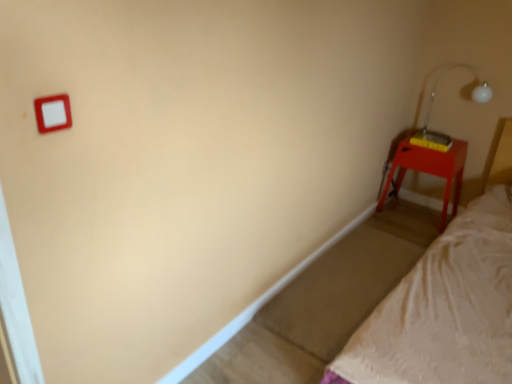
Question: Is transparent plastic lamp at upper right smaller than matte red nightstand at right?

Choices:
 (A) yes
 (B) no

Answer: (A)

Question: Considering the relative sizes of transparent plastic lamp at upper right and matte red nightstand at right in the image provided, is transparent plastic lamp at upper right wider than matte red nightstand at right?

Choices:
 (A) no
 (B) yes

Answer: (A)

Question: Does transparent plastic lamp at upper right have a lesser width compared to matte red nightstand at right?

Choices:
 (A) no
 (B) yes

Answer: (B)

Question: Can you confirm if transparent plastic lamp at upper right is positioned to the right of matte red nightstand at right?

Choices:
 (A) no
 (B) yes

Answer: (B)

Question: Is transparent plastic lamp at upper right oriented towards matte red nightstand at right?

Choices:
 (A) no
 (B) yes

Answer: (A)

Question: Considering the relative positions of transparent plastic lamp at upper right and matte red nightstand at right in the image provided, is transparent plastic lamp at upper right to the left of matte red nightstand at right from the viewer's perspective?

Choices:
 (A) yes
 (B) no

Answer: (B)

Question: Is matte red nightstand at right taller than transparent plastic lamp at upper right?

Choices:
 (A) no
 (B) yes

Answer: (B)

Question: Is matte red nightstand at right smaller than transparent plastic lamp at upper right?

Choices:
 (A) no
 (B) yes

Answer: (A)

Question: From the image's perspective, is matte red nightstand at right under transparent plastic lamp at upper right?

Choices:
 (A) yes
 (B) no

Answer: (A)

Question: Would you say matte red nightstand at right contains transparent plastic lamp at upper right?

Choices:
 (A) no
 (B) yes

Answer: (A)

Question: Is matte red nightstand at right positioned behind transparent plastic lamp at upper right?

Choices:
 (A) yes
 (B) no

Answer: (A)

Question: Is matte red nightstand at right to the left of transparent plastic lamp at upper right from the viewer's perspective?

Choices:
 (A) no
 (B) yes

Answer: (B)

Question: Visually, is matte red nightstand at right positioned to the left or to the right of transparent plastic lamp at upper right?

Choices:
 (A) left
 (B) right

Answer: (A)